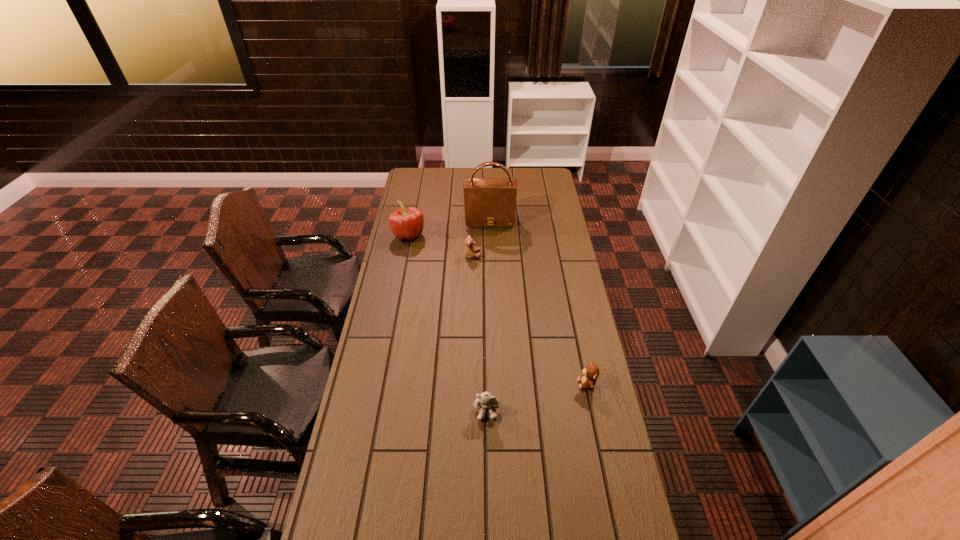
At what (x,y) coordinates should I click in order to perform the action: click on shoulder bag. Please return your answer as a coordinate pair (x, y). The image size is (960, 540). Looking at the image, I should click on (488, 202).

At what (x,y) coordinates should I click in order to perform the action: click on the second tallest object. Please return your answer as a coordinate pair (x, y). Looking at the image, I should click on (406, 223).

Where is `the leftmost object`? The image size is (960, 540). the leftmost object is located at coordinates (406, 223).

Locate an element on the screen. The image size is (960, 540). the third nearest object is located at coordinates (470, 250).

Where is `the nearest object`? Image resolution: width=960 pixels, height=540 pixels. the nearest object is located at coordinates (484, 401).

Find the location of a particular element. Image resolution: width=960 pixels, height=540 pixels. the rightmost object is located at coordinates (590, 374).

Identify the location of the second farthest teddy bear. (590, 374).

At what (x,y) coordinates should I click in order to perform the action: click on vacant space situated 0.290m on the front flap of the tallest object. Please return your answer as a coordinate pair (x, y). The width and height of the screenshot is (960, 540). Looking at the image, I should click on (491, 266).

The image size is (960, 540). What are the coordinates of `free space located on the front of the bell pepper` in the screenshot? It's located at (398, 287).

Image resolution: width=960 pixels, height=540 pixels. Find the location of `vacant area situated on the front-facing side of the farthest teddy bear`. vacant area situated on the front-facing side of the farthest teddy bear is located at coordinates (495, 255).